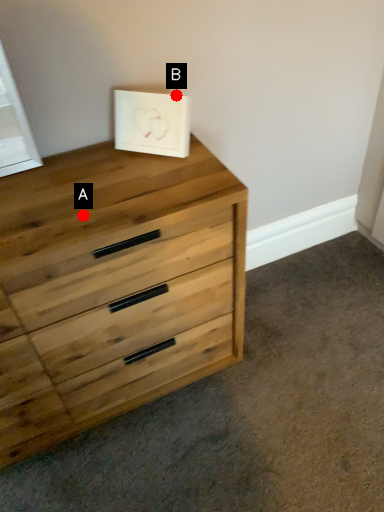
Question: Two points are circled on the image, labeled by A and B beside each circle. Which point is farther to the camera?

Choices:
 (A) A is further
 (B) B is further

Answer: (B)